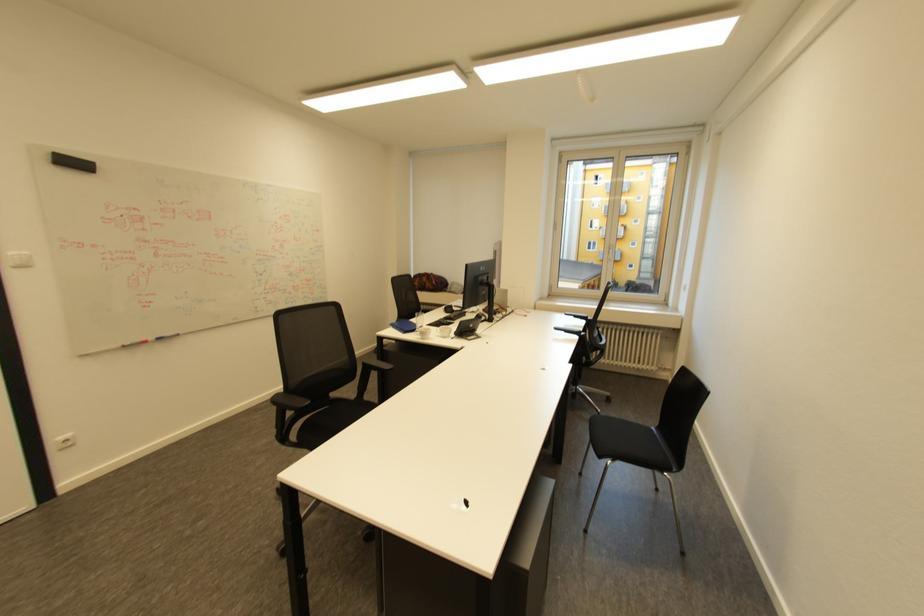
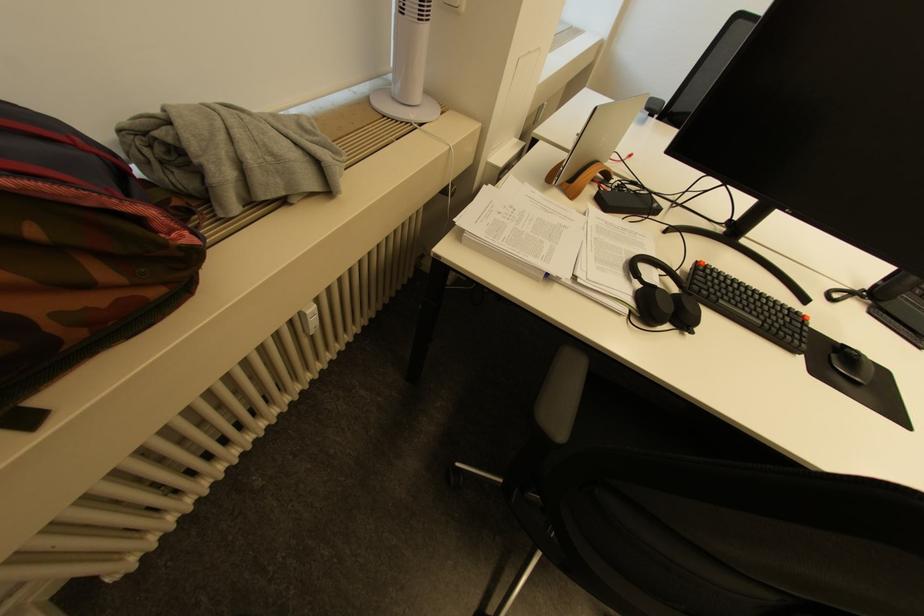
The point at (440, 282) is marked in the first image. Where is the corresponding point in the second image?

(196, 238)